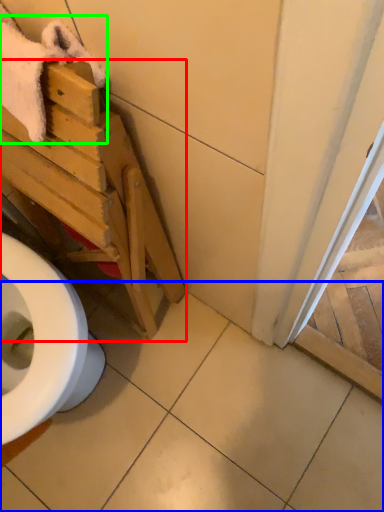
Question: Which object is the farthest from furniture (highlighted by a red box)? Choose among these: tile (highlighted by a blue box) or bath towel (highlighted by a green box).

Choices:
 (A) tile
 (B) bath towel

Answer: (A)